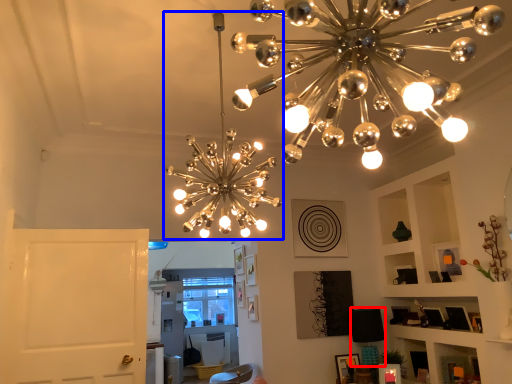
Question: Which object appears farthest to the camera in this image, lamp (highlighted by a red box) or lamp (highlighted by a blue box)?

Choices:
 (A) lamp
 (B) lamp

Answer: (A)